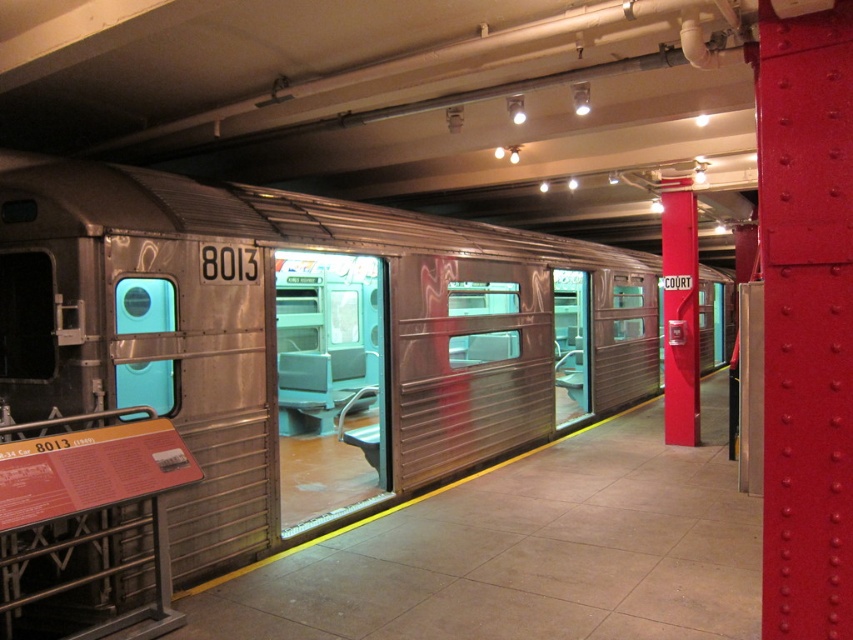
You are an interior designer assessing the subway car exhibit. You need to determine if the smooth red pillar at center right can be moved closer to the teal plastic door at center without obstructing the door. Based on their heights, can the pillar be moved closer?

The smooth red pillar at center right is much taller than the teal plastic door at center. Moving the pillar closer would not affect the door since height differences do not impact horizontal placement.

You are a visitor in the museum and want to take a photo of the teal plastic door at center without the smooth red pillar at center right appearing in the frame. Is this possible given their positions?

The smooth red pillar at center right is to the right of the teal plastic door at center, so you can position yourself to the left side of the teal plastic door at center to avoid including the smooth red pillar at center right in your photo.